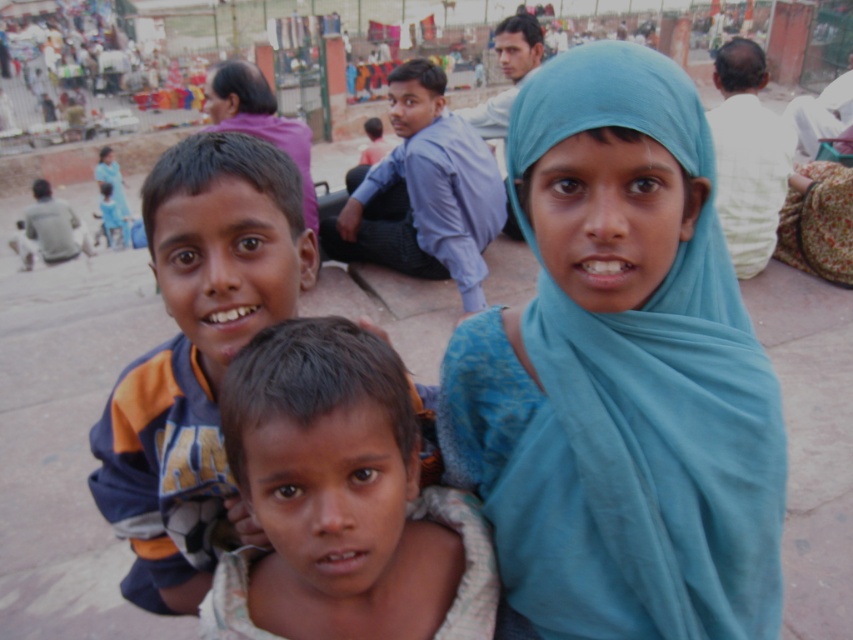
Question: Is blue fabric headscarf at upper right positioned at the back of blue cotton shirt at center?

Choices:
 (A) no
 (B) yes

Answer: (A)

Question: Among these objects, which one is farthest from the camera?

Choices:
 (A) blue fabric headscarf at upper right
 (B) orange and gray hoodie at center
 (C) blue cotton shirt at center

Answer: (C)

Question: Is blue fabric headscarf at upper right positioned before light brown skin child at center?

Choices:
 (A) no
 (B) yes

Answer: (A)

Question: Can you confirm if orange and gray hoodie at center is wider than blue cotton shirt at center?

Choices:
 (A) no
 (B) yes

Answer: (A)

Question: Which point appears closest to the camera in this image?

Choices:
 (A) (643, 76)
 (B) (495, 172)

Answer: (A)

Question: Which object appears closest to the camera in this image?

Choices:
 (A) light brown skin child at center
 (B) orange and gray hoodie at center
 (C) blue fabric headscarf at upper right

Answer: (A)